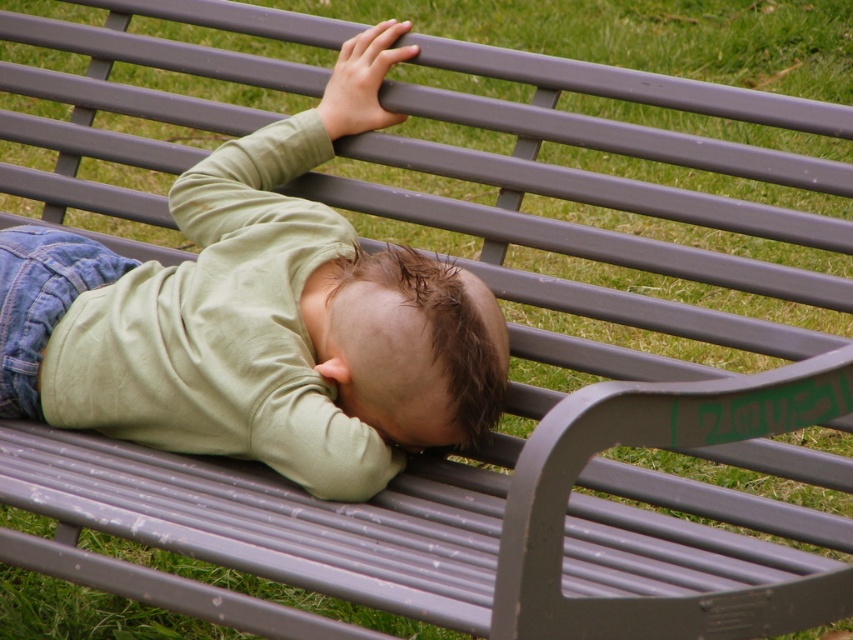
Question: Which point is farther from the camera taking this photo?

Choices:
 (A) (494, 369)
 (B) (128, 304)
 (C) (367, 96)

Answer: (C)

Question: Where is matte green shirt at center located in relation to matte gray bench at upper center in the image?

Choices:
 (A) left
 (B) right

Answer: (A)

Question: From the image, what is the correct spatial relationship of matte green shirt at center in relation to matte gray bench at upper center?

Choices:
 (A) right
 (B) left

Answer: (B)

Question: Observing the image, what is the correct spatial positioning of matte green shirt at center in reference to matte gray bench at upper center?

Choices:
 (A) above
 (B) below

Answer: (B)

Question: Among these objects, which one is nearest to the camera?

Choices:
 (A) matte green shirt at center
 (B) brown matte hair at center

Answer: (A)

Question: Among these points, which one is farthest from the camera?

Choices:
 (A) (456, 417)
 (B) (500, 372)

Answer: (B)